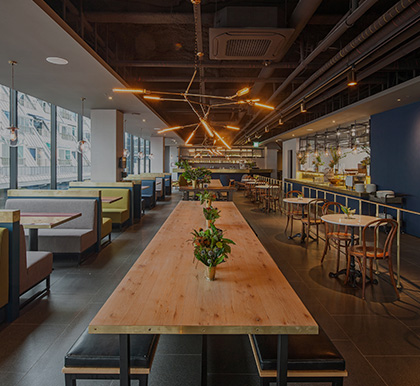
Identify the location of round tables. Image resolution: width=420 pixels, height=386 pixels. (354, 220), (299, 199), (262, 186), (253, 183), (246, 179).